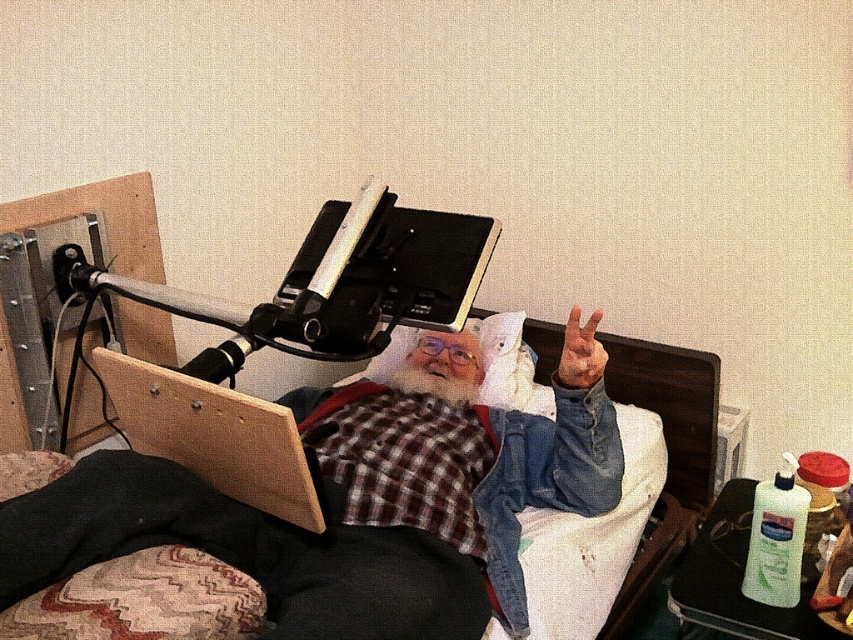
Question: Does denim bed at center appear under brown leather hand at upper right?

Choices:
 (A) no
 (B) yes

Answer: (B)

Question: Which of the following is the farthest from the observer?

Choices:
 (A) wooden board at lower left
 (B) brown leather hand at upper right
 (C) denim bed at center

Answer: (B)

Question: Which of the following is the closest to the observer?

Choices:
 (A) wooden board at lower left
 (B) denim bed at center
 (C) brown leather hand at upper right

Answer: (B)

Question: Which object is closer to the camera taking this photo?

Choices:
 (A) wooden board at lower left
 (B) denim bed at center

Answer: (B)

Question: Can you confirm if denim bed at center is bigger than brown leather hand at upper right?

Choices:
 (A) yes
 (B) no

Answer: (A)

Question: Is wooden board at lower left to the right of brown leather hand at upper right from the viewer's perspective?

Choices:
 (A) no
 (B) yes

Answer: (A)